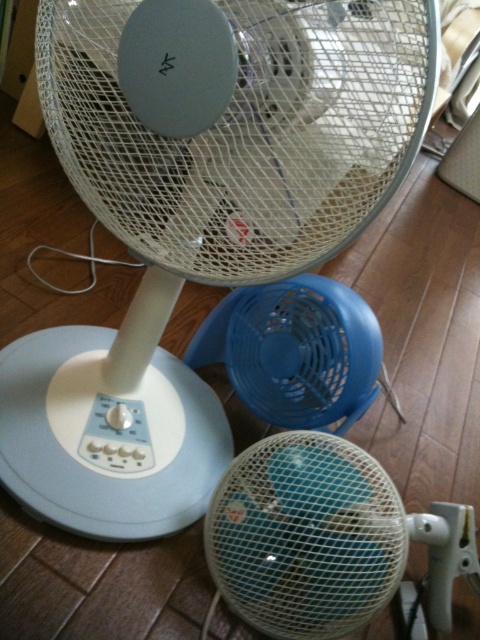
Between blue mesh fan at center and blue plastic fan at center, which one is positioned higher?

blue plastic fan at center is above.

Consider the image. Which is more to the right, blue mesh fan at center or blue plastic fan at center?

blue mesh fan at center is more to the right.

What are the coordinates of `blue mesh fan at center` in the screenshot? It's located at (324, 538).